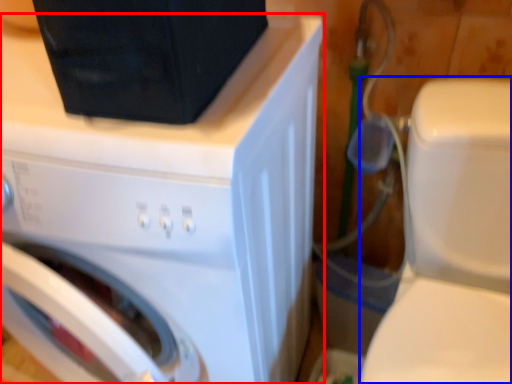
Question: Which point is closer to the camera, washing machine (highlighted by a red box) or washer (highlighted by a blue box)?

Choices:
 (A) washing machine
 (B) washer

Answer: (B)